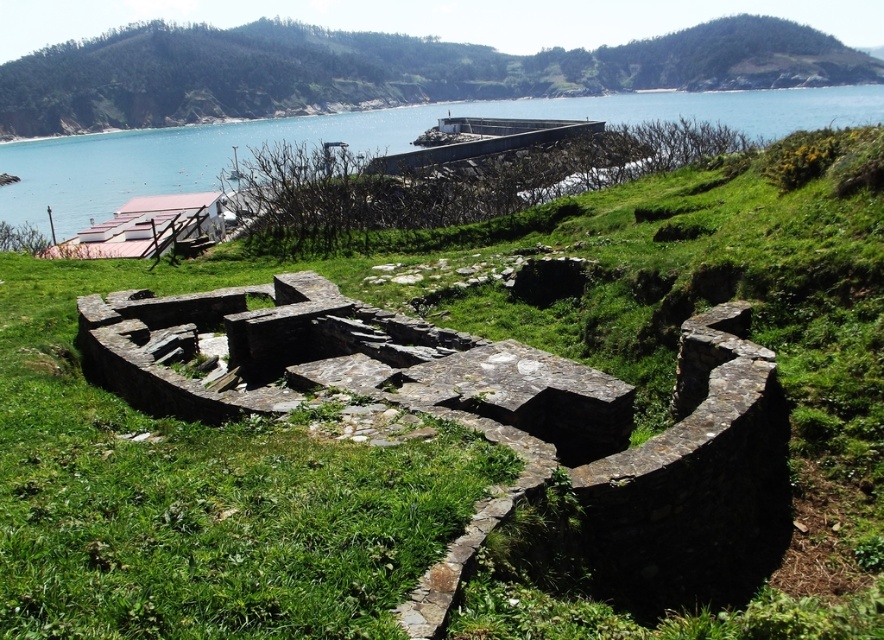
Consider the image. Does green stone ruins at center appear under blue water at center?

No, green stone ruins at center is not below blue water at center.

Based on the photo, is green stone ruins at center further to the viewer compared to blue water at center?

Yes, it is behind blue water at center.

Find the location of a particular element. This screenshot has height=640, width=884. green stone ruins at center is located at coordinates (383, 72).